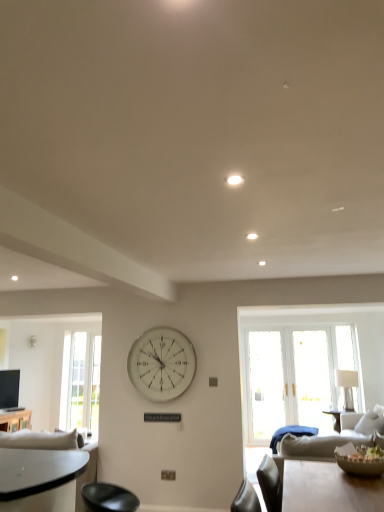
Question: Can you confirm if white fabric lampshade at right is thinner than wooden table at lower left?

Choices:
 (A) yes
 (B) no

Answer: (A)

Question: Is white fabric lampshade at right further to the viewer compared to wooden table at lower left?

Choices:
 (A) no
 (B) yes

Answer: (B)

Question: Is wooden table at lower left at the back of white fabric lampshade at right?

Choices:
 (A) no
 (B) yes

Answer: (A)

Question: From the image's perspective, is white fabric lampshade at right located beneath wooden table at lower left?

Choices:
 (A) no
 (B) yes

Answer: (A)

Question: From the image's perspective, is white fabric lampshade at right on wooden table at lower left?

Choices:
 (A) no
 (B) yes

Answer: (B)

Question: Is white fabric lampshade at right shorter than wooden table at lower left?

Choices:
 (A) yes
 (B) no

Answer: (B)

Question: Is clear glass door at left closer to camera compared to wooden table at lower left?

Choices:
 (A) no
 (B) yes

Answer: (A)

Question: Could you tell me if clear glass door at left is facing wooden table at lower left?

Choices:
 (A) yes
 (B) no

Answer: (B)

Question: Does clear glass door at left have a larger size compared to wooden table at lower left?

Choices:
 (A) no
 (B) yes

Answer: (A)

Question: Is clear glass door at left to the left of wooden table at lower left from the viewer's perspective?

Choices:
 (A) no
 (B) yes

Answer: (A)

Question: From the image's perspective, is clear glass door at left under wooden table at lower left?

Choices:
 (A) yes
 (B) no

Answer: (B)

Question: Considering the relative positions of clear glass door at left and wooden table at lower left in the image provided, is clear glass door at left to the right of wooden table at lower left from the viewer's perspective?

Choices:
 (A) yes
 (B) no

Answer: (A)

Question: Is white fabric lampshade at right completely or partially outside of clear glass door at left?

Choices:
 (A) yes
 (B) no

Answer: (A)